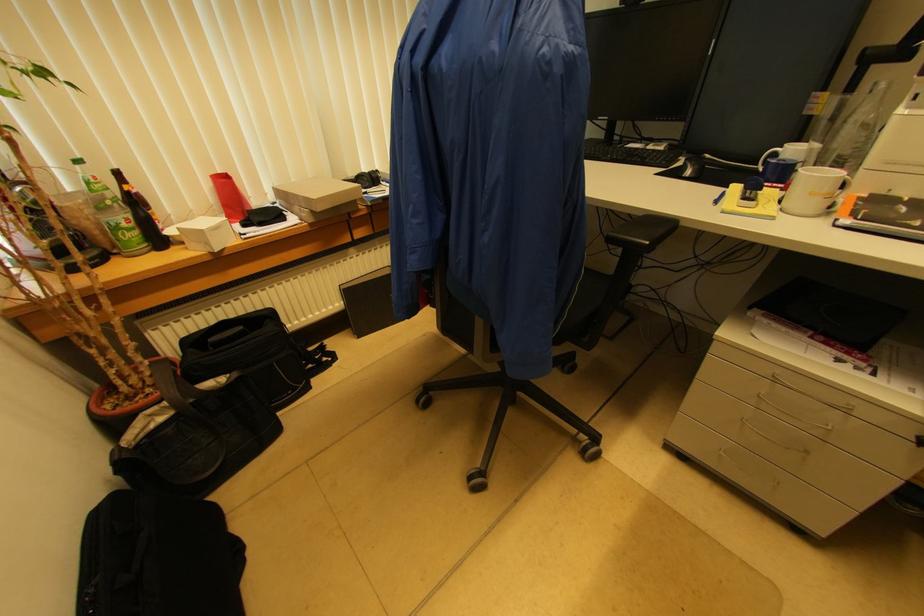
The height and width of the screenshot is (616, 924). What do you see at coordinates (841, 190) in the screenshot?
I see `the white mug handle` at bounding box center [841, 190].